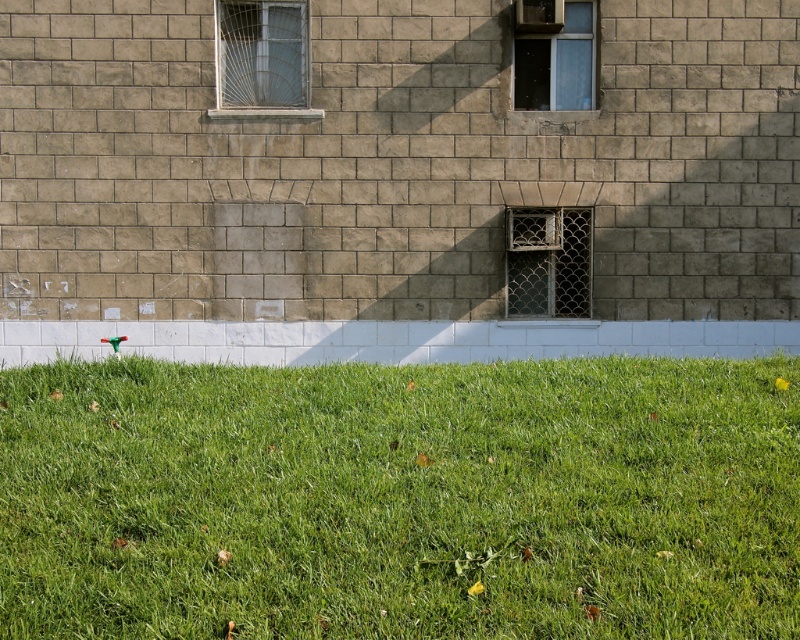
Question: Which object is the closest to the clear glass window at upper center?

Choices:
 (A) rusty metal grate at center
 (B) metallic grid window at upper left

Answer: (A)

Question: Which point is closer to the camera?

Choices:
 (A) metallic grid window at upper left
 (B) green grass at lower center
 (C) rusty metal grate at center
 (D) clear glass window at upper center

Answer: (B)

Question: Is rusty metal grate at center to the left of clear glass window at upper center from the viewer's perspective?

Choices:
 (A) yes
 (B) no

Answer: (A)

Question: Which of the following is the farthest from the observer?

Choices:
 (A) pyautogui.click(x=786, y=433)
 (B) pyautogui.click(x=520, y=49)
 (C) pyautogui.click(x=516, y=248)

Answer: (B)

Question: Is green grass at lower center smaller than metallic grid window at upper left?

Choices:
 (A) no
 (B) yes

Answer: (A)

Question: Can you confirm if rusty metal grate at center is positioned to the left of clear glass window at upper center?

Choices:
 (A) no
 (B) yes

Answer: (B)